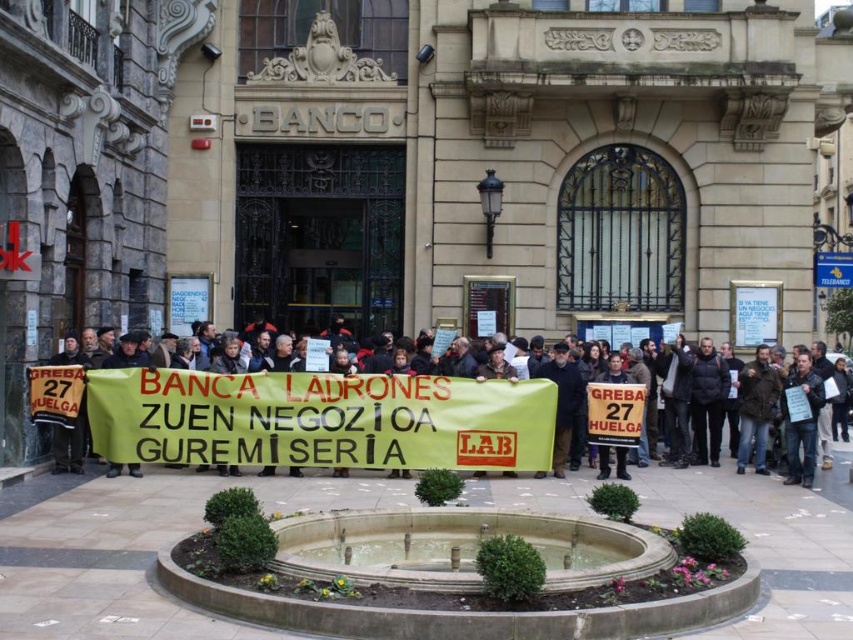
You are standing at the camera position and want to walk to the point marked as point (93, 385). How far will you have to walk in feet?

The distance between point (93, 385) and the camera is 147.96 feet, so you will have to walk 147.96 feet.

You are a photographer standing in front of the BANCO building. You want to take a photo of the dark gray jacket at center and the white paper sign at center. Which object is positioned closer to your camera lens?

The dark gray jacket at center is closer to the viewer than the white paper sign at center, so the dark gray jacket at center would be closer to your camera lens.

You are standing at the entrance of the BANCO building and see the dark gray jacket at center and the white paper sign at center. If you want to reach both items, which one would you need to walk further to get to?

The dark gray jacket at center is 14.28 meters away from the white paper sign at center. Since you are at the entrance, you would need to walk further to reach whichever item is farther from your starting point. However, the exact distance from the entrance to each item isn